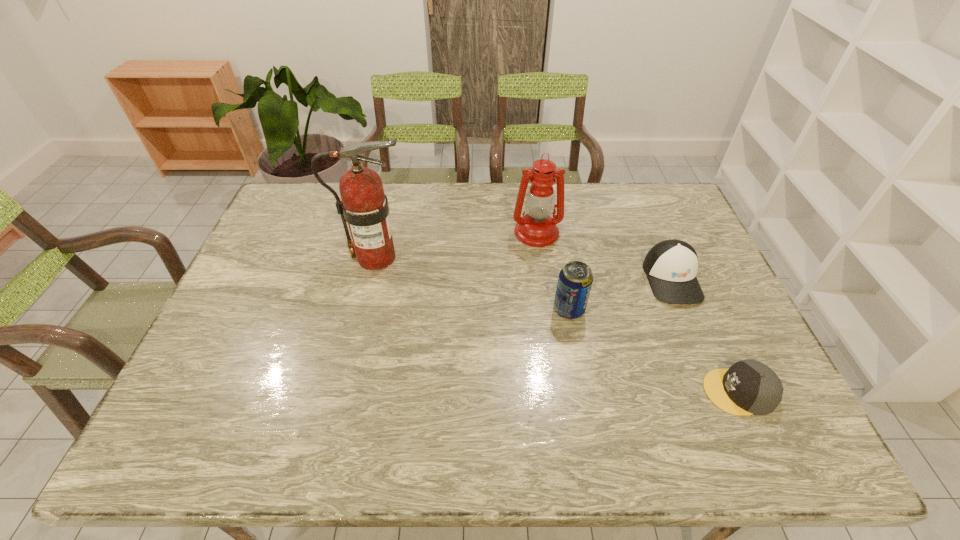
The image size is (960, 540). Identify the location of the tallest object. (364, 206).

Where is `the leftmost object`? The image size is (960, 540). the leftmost object is located at coordinates click(364, 206).

Find the location of a particular element. The width and height of the screenshot is (960, 540). oil lamp is located at coordinates (537, 228).

Locate an element on the screen. The width and height of the screenshot is (960, 540). the third shortest object is located at coordinates (575, 280).

At what (x,y) coordinates should I click in order to perform the action: click on the taller cap. Please return your answer as a coordinate pair (x, y). This screenshot has width=960, height=540. Looking at the image, I should click on (671, 266).

This screenshot has height=540, width=960. I want to click on the farther cap, so click(671, 266).

Locate an element on the screen. The image size is (960, 540). the nearer cap is located at coordinates (749, 387).

The image size is (960, 540). In order to click on the nearest object in this screenshot , I will do `click(749, 387)`.

At what (x,y) coordinates should I click in order to perform the action: click on vacant space located 0.320m at the nozzle of the leftmost object. Please return your answer as a coordinate pair (x, y). The height and width of the screenshot is (540, 960). Looking at the image, I should click on (516, 258).

The image size is (960, 540). Identify the location of free space located on the front of the oil lamp. (540, 262).